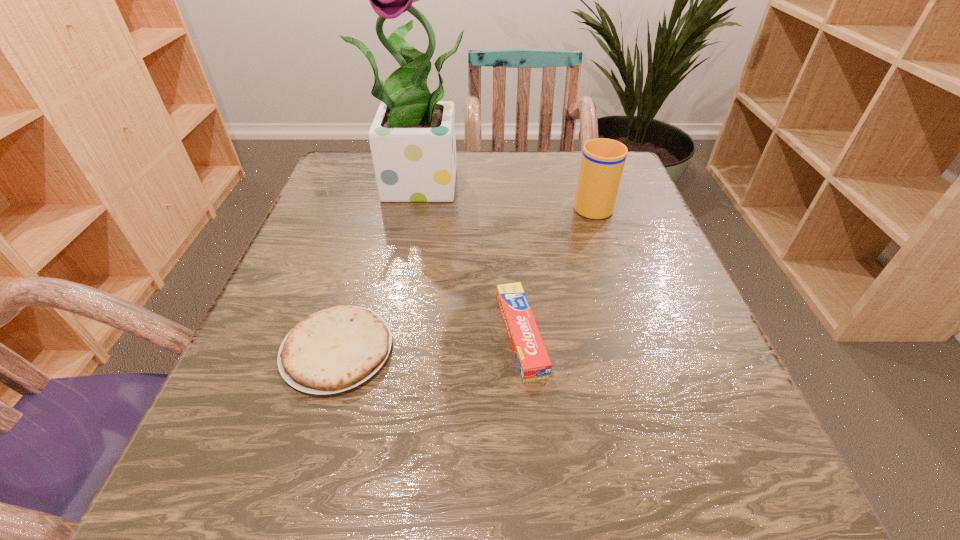
What are the coordinates of `free point between the rightmost object and the shortest object` in the screenshot? It's located at (465, 277).

At what (x,y) coordinates should I click in order to perform the action: click on free point between the third shortest object and the flower arrangement. Please return your answer as a coordinate pair (x, y). Image resolution: width=960 pixels, height=540 pixels. Looking at the image, I should click on (510, 193).

The width and height of the screenshot is (960, 540). I want to click on vacant area that lies between the third tallest object and the shortest object, so click(429, 342).

At what (x,y) coordinates should I click in order to perform the action: click on empty space between the shortest object and the cup. Please return your answer as a coordinate pair (x, y). Looking at the image, I should click on (465, 277).

The image size is (960, 540). I want to click on vacant area that lies between the tortilla and the third object from left to right, so click(x=429, y=342).

Find the location of a particular element. The image size is (960, 540). blank region between the tortilla and the second shortest object is located at coordinates (429, 342).

Locate which object ranks third in proximity to the tallest object. Please provide its 2D coordinates. Your answer should be formatted as a tuple, i.e. [(x, y)], where the tuple contains the x and y coordinates of a point satisfying the conditions above.

[(336, 349)]

At what (x,y) coordinates should I click in order to perform the action: click on object that is the second closest to the rightmost object. Please return your answer as a coordinate pair (x, y). The height and width of the screenshot is (540, 960). Looking at the image, I should click on (530, 353).

This screenshot has height=540, width=960. I want to click on vacant space that satisfies the following two spatial constraints: 1. on the front-facing side of the tallest object; 2. on the left side of the toothpaste, so click(x=403, y=335).

Where is `vacant space that satisfies the following two spatial constraints: 1. on the front-facing side of the tallest object; 2. on the right side of the second object from right to left`? vacant space that satisfies the following two spatial constraints: 1. on the front-facing side of the tallest object; 2. on the right side of the second object from right to left is located at coordinates click(x=403, y=335).